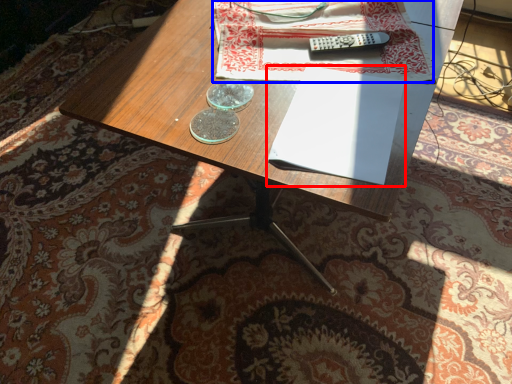
Question: Which object is further to the camera taking this photo, paperback book (highlighted by a red box) or sheet (highlighted by a blue box)?

Choices:
 (A) paperback book
 (B) sheet

Answer: (B)